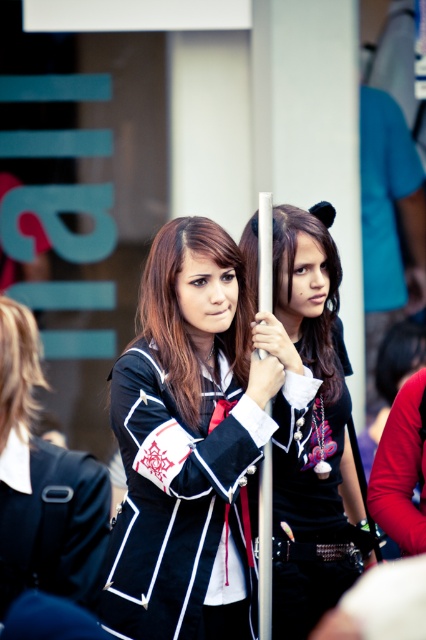
Question: Based on their relative distances, which object is nearer to the black satin cosplay jacket at center?

Choices:
 (A) black satin school uniform at center
 (B) black matte jacket at center
 (C) metallic silver pole at center
 (D) satin black uniform at center

Answer: (D)

Question: Observing the image, what is the correct spatial positioning of black satin school uniform at center in reference to metallic silver pole at center?

Choices:
 (A) right
 (B) left

Answer: (B)

Question: Considering the real-world distances, which object is closest to the metallic silver pole at center?

Choices:
 (A) black satin cosplay jacket at center
 (B) black satin school uniform at center

Answer: (A)

Question: Is black satin cosplay jacket at center thinner than black satin school uniform at center?

Choices:
 (A) yes
 (B) no

Answer: (B)

Question: Among these objects, which one is nearest to the camera?

Choices:
 (A) metallic silver pole at center
 (B) black matte jacket at center
 (C) black satin cosplay jacket at center

Answer: (C)

Question: Is black matte jacket at center below black satin school uniform at center?

Choices:
 (A) no
 (B) yes

Answer: (A)